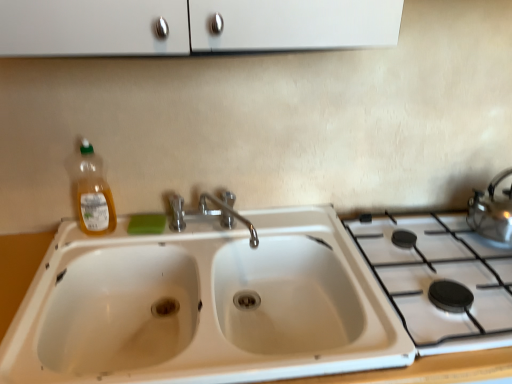
Question: In the image, is chrome metallic faucet at center positioned in front of or behind green matte soap at center?

Choices:
 (A) behind
 (B) front

Answer: (B)

Question: In terms of height, does chrome metallic faucet at center look taller or shorter compared to green matte soap at center?

Choices:
 (A) tall
 (B) short

Answer: (A)

Question: Based on their relative distances, which object is nearer to the white ceramic sink at center?

Choices:
 (A) satin silver kettle at right
 (B) translucent plastic bottle at left
 (C) white ceramic gas stove at right
 (D) green matte soap at center
 (E) chrome metallic faucet at center

Answer: (E)

Question: Which object is positioned closest to the translucent plastic bottle at left?

Choices:
 (A) white ceramic gas stove at right
 (B) white ceramic sink at center
 (C) satin silver kettle at right
 (D) green matte soap at center
 (E) chrome metallic faucet at center

Answer: (D)